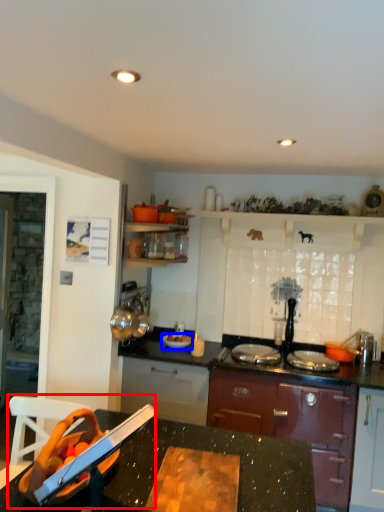
Question: Which object is closer to the camera taking this photo, sink (highlighted by a red box) or kitchen appliance (highlighted by a blue box)?

Choices:
 (A) sink
 (B) kitchen appliance

Answer: (A)